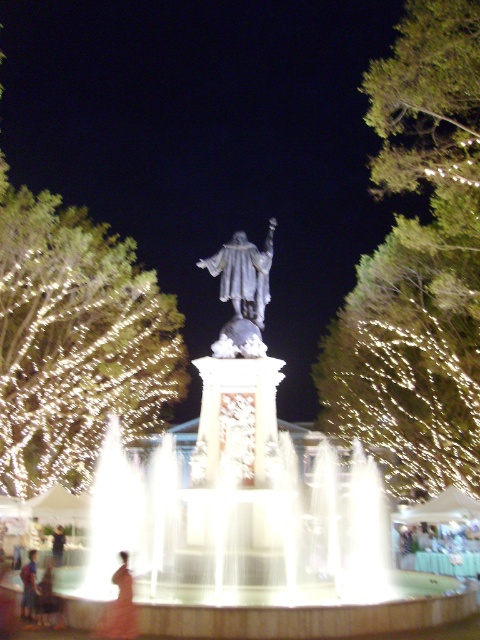
Question: Estimate the real-world distances between objects in this image. Which object is farther from the matte black dress at lower center?

Choices:
 (A) satin silver statue at center
 (B) orange fabric dress at lower left
 (C) green leafy tree at upper right

Answer: (C)

Question: Among these objects, which one is nearest to the camera?

Choices:
 (A) orange fabric dress at lower left
 (B) satin silver statue at center
 (C) silky orange dress at lower left
 (D) matte black dress at lower center

Answer: (C)

Question: Is green leafy tree at upper right wider than matte black dress at lower center?

Choices:
 (A) no
 (B) yes

Answer: (B)

Question: Is the position of green leafy tree at left more distant than that of satin silver statue at center?

Choices:
 (A) yes
 (B) no

Answer: (A)

Question: Is satin silver statue at center wider than silky orange dress at lower left?

Choices:
 (A) no
 (B) yes

Answer: (B)

Question: Which of the following is the closest to the observer?

Choices:
 (A) (124, 595)
 (B) (57, 605)
 (C) (24, 577)
 (D) (399, 88)

Answer: (A)